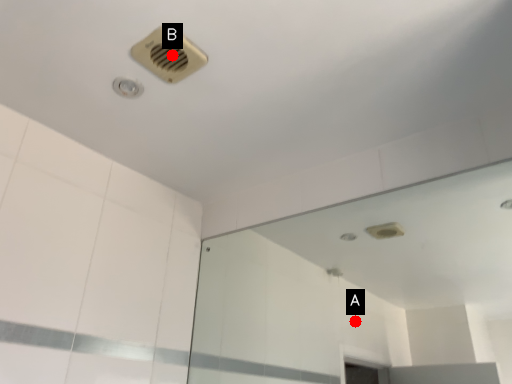
Question: Two points are circled on the image, labeled by A and B beside each circle. Among these points, which one is farthest from the camera?

Choices:
 (A) A is further
 (B) B is further

Answer: (A)